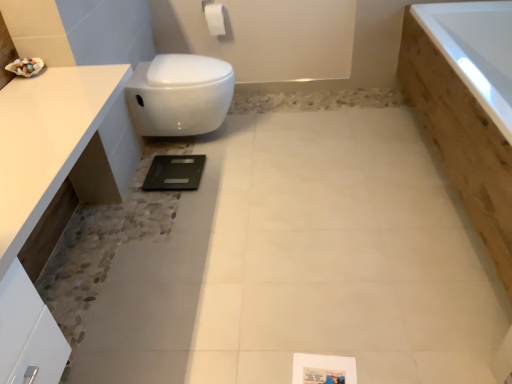
Locate an element on the screen. This screenshot has height=384, width=512. vacant point to the right of white glossy toilet at upper left is located at coordinates (268, 143).